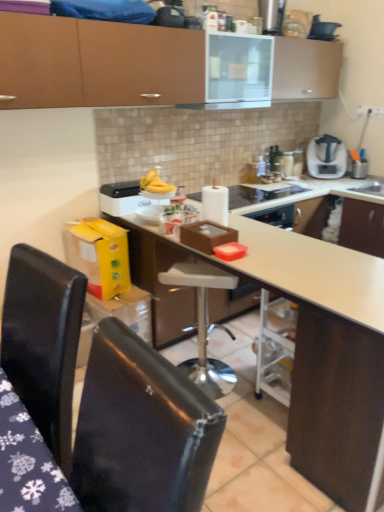
Question: Is satin silver blender at upper right wider than black plastic kettle at upper center?

Choices:
 (A) yes
 (B) no

Answer: (A)

Question: Is satin silver blender at upper right located outside black plastic kettle at upper center?

Choices:
 (A) yes
 (B) no

Answer: (A)

Question: Is satin silver blender at upper right not near black plastic kettle at upper center?

Choices:
 (A) yes
 (B) no

Answer: (B)

Question: Does satin silver blender at upper right lie behind black plastic kettle at upper center?

Choices:
 (A) no
 (B) yes

Answer: (B)

Question: From the image's perspective, does satin silver blender at upper right appear lower than black plastic kettle at upper center?

Choices:
 (A) no
 (B) yes

Answer: (B)

Question: From a real-world perspective, is satin silver blender at upper right located beneath black plastic kettle at upper center?

Choices:
 (A) no
 (B) yes

Answer: (B)

Question: Considering the relative sizes of satin silver blender at upper right and white matte countertop at center in the image provided, is satin silver blender at upper right smaller than white matte countertop at center?

Choices:
 (A) yes
 (B) no

Answer: (A)

Question: Is satin silver blender at upper right next to white matte countertop at center?

Choices:
 (A) yes
 (B) no

Answer: (B)

Question: Does satin silver blender at upper right have a greater height compared to white matte countertop at center?

Choices:
 (A) yes
 (B) no

Answer: (B)

Question: Are satin silver blender at upper right and white matte countertop at center located far from each other?

Choices:
 (A) yes
 (B) no

Answer: (A)

Question: From a real-world perspective, is satin silver blender at upper right under white matte countertop at center?

Choices:
 (A) no
 (B) yes

Answer: (A)

Question: From the image's perspective, does satin silver blender at upper right appear lower than white matte countertop at center?

Choices:
 (A) no
 (B) yes

Answer: (A)

Question: From the image's perspective, is black plastic kettle at upper center above black leather chair at lower left, placed as the 1th chair when sorted from left to right?

Choices:
 (A) yes
 (B) no

Answer: (A)